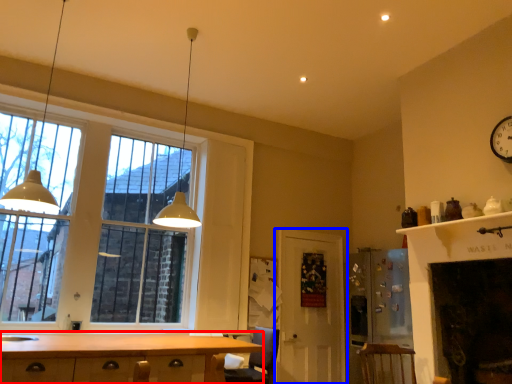
Question: Which point is further to the camera, cabinetry (highlighted by a red box) or door (highlighted by a blue box)?

Choices:
 (A) cabinetry
 (B) door

Answer: (B)